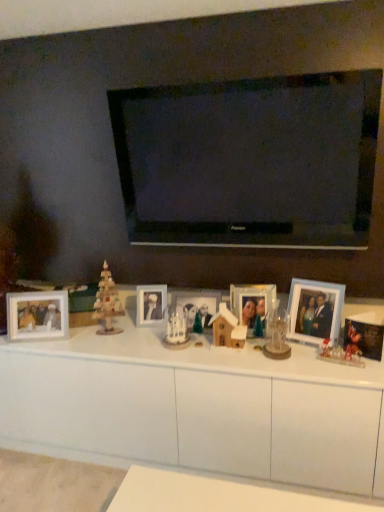
Locate an element on the screen. This screenshot has height=512, width=384. vacant area situated to the left side of metallic mickey mouse photo frame at right, the first picture frame viewed from the right is located at coordinates (321, 357).